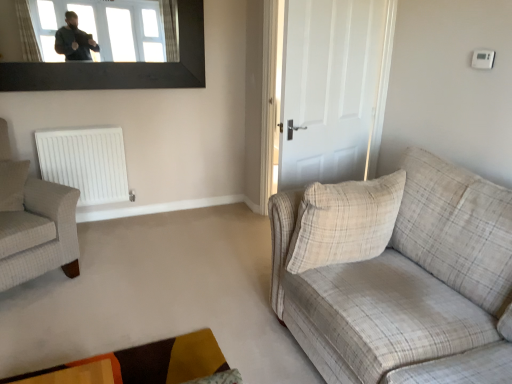
At what (x,y) coordinates should I click in order to perform the action: click on vacant location below white matte radiator at left (from a real-world perspective). Please return your answer as a coordinate pair (x, y). The height and width of the screenshot is (384, 512). Looking at the image, I should click on (104, 215).